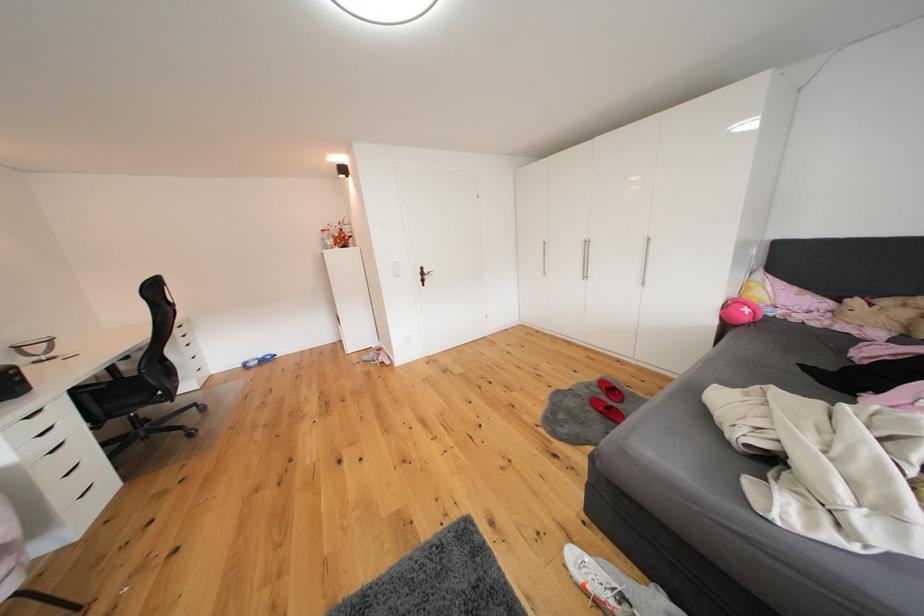
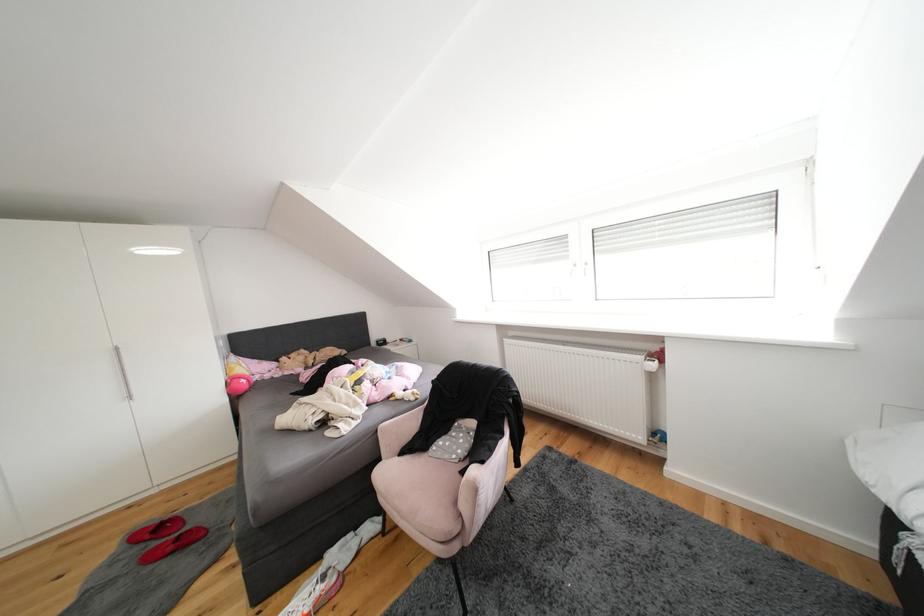
In the second image, find the point that corresponds to pixel 606 394 in the first image.

(146, 553)